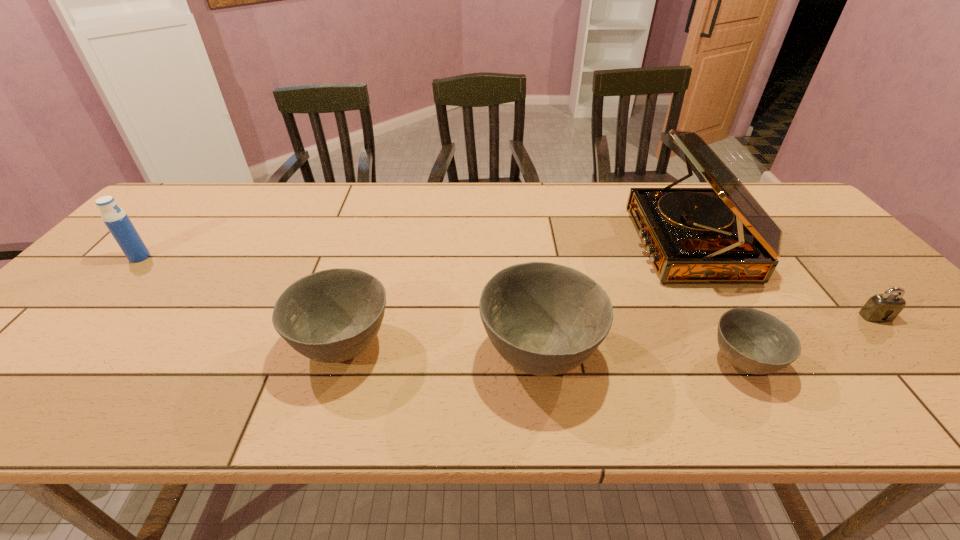
Identify which object is located as the third nearest to the fourth object from right to left. Please provide its 2D coordinates. Your answer should be formatted as a tuple, i.e. [(x, y)], where the tuple contains the x and y coordinates of a point satisfying the conditions above.

[(756, 342)]

Locate an element on the screen. This screenshot has height=540, width=960. object that stands as the fourth closest to the second bowl from right to left is located at coordinates (880, 308).

Identify which bowl is the nearest to the rightmost object. Please provide its 2D coordinates. Your answer should be formatted as a tuple, i.e. [(x, y)], where the tuple contains the x and y coordinates of a point satisfying the conditions above.

[(756, 342)]

Select which bowl appears as the third closest to the rightmost object. Please provide its 2D coordinates. Your answer should be formatted as a tuple, i.e. [(x, y)], where the tuple contains the x and y coordinates of a point satisfying the conditions above.

[(333, 315)]